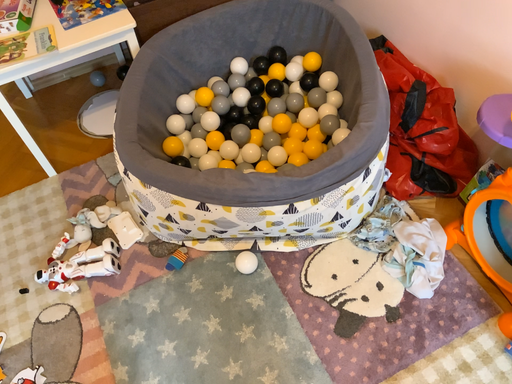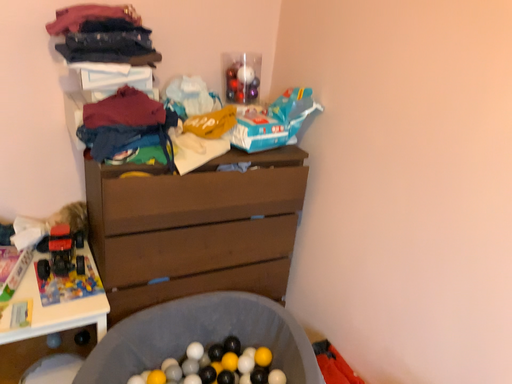
Question: How did the camera likely rotate when shooting the video?

Choices:
 (A) rotated upward
 (B) rotated downward

Answer: (A)